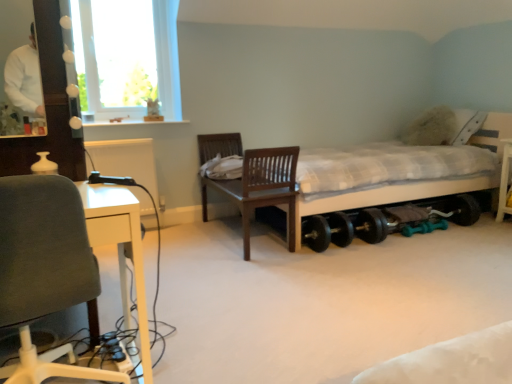
Question: Should I look upward or downward to see white matte sweater at upper left?

Choices:
 (A) up
 (B) down

Answer: (A)

Question: Can you confirm if black rubber wheel at lower center is taller than gray fabric chair at left, positioned as the second chair in right-to-left order?

Choices:
 (A) yes
 (B) no

Answer: (B)

Question: Is black rubber wheel at lower center to the right of gray fabric chair at left, positioned as the second chair in right-to-left order, from the viewer's perspective?

Choices:
 (A) no
 (B) yes

Answer: (B)

Question: Is black rubber wheel at lower center with gray fabric chair at left, which appears as the 1th chair when viewed from the left?

Choices:
 (A) no
 (B) yes

Answer: (A)

Question: Is black rubber wheel at lower center not near gray fabric chair at left, which appears as the 1th chair when viewed from the left?

Choices:
 (A) no
 (B) yes

Answer: (B)

Question: Is black rubber wheel at lower center not within gray fabric chair at left, positioned as the second chair in right-to-left order?

Choices:
 (A) no
 (B) yes

Answer: (B)

Question: Can you confirm if black rubber wheel at lower center is thinner than gray fabric chair at left, the first chair when ordered from front to back?

Choices:
 (A) no
 (B) yes

Answer: (B)

Question: Considering the relative sizes of wooden chair at center, which is the second chair in left-to-right order, and white glass window at upper left in the image provided, is wooden chair at center, which is the second chair in left-to-right order, wider than white glass window at upper left?

Choices:
 (A) yes
 (B) no

Answer: (A)

Question: Does wooden chair at center, the 2th chair in the front-to-back sequence, lie behind white glass window at upper left?

Choices:
 (A) no
 (B) yes

Answer: (A)

Question: Is wooden chair at center, placed as the first chair when sorted from right to left, thinner than white glass window at upper left?

Choices:
 (A) yes
 (B) no

Answer: (B)

Question: From a real-world perspective, is wooden chair at center, the first chair from the back, under white glass window at upper left?

Choices:
 (A) no
 (B) yes

Answer: (B)

Question: Does wooden chair at center, which is the second chair in left-to-right order, have a greater height compared to white glass window at upper left?

Choices:
 (A) no
 (B) yes

Answer: (A)

Question: Is wooden chair at center, the first chair from the back, to the left of white glass window at upper left from the viewer's perspective?

Choices:
 (A) no
 (B) yes

Answer: (A)

Question: Does white checkered bed at center touch gray fabric chair at left, the first chair when ordered from front to back?

Choices:
 (A) yes
 (B) no

Answer: (B)